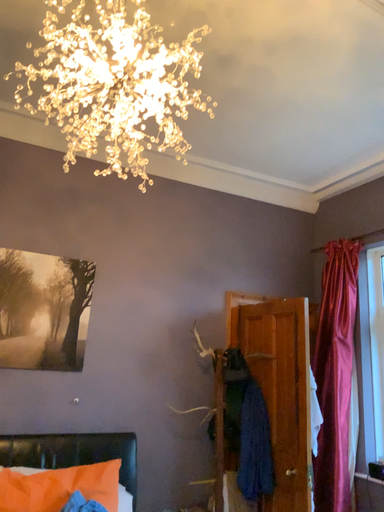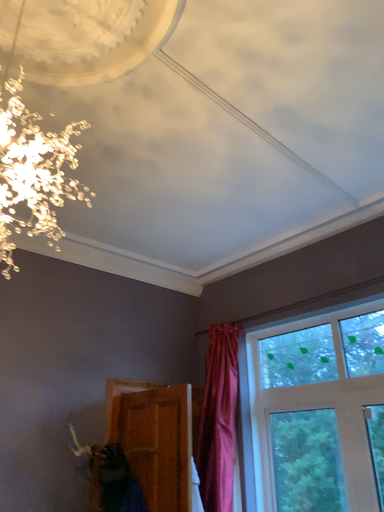
Question: Which way did the camera rotate in the video?

Choices:
 (A) rotated upward
 (B) rotated downward

Answer: (A)